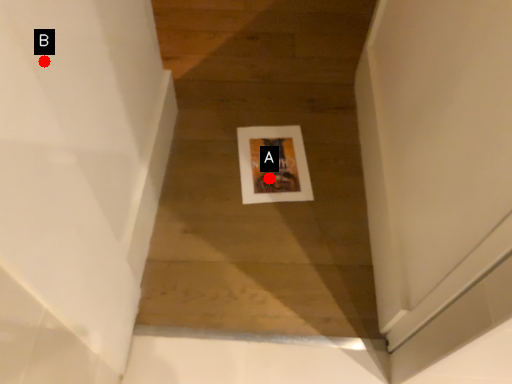
Question: Two points are circled on the image, labeled by A and B beside each circle. Which of the following is the closest to the observer?

Choices:
 (A) A is closer
 (B) B is closer

Answer: (B)